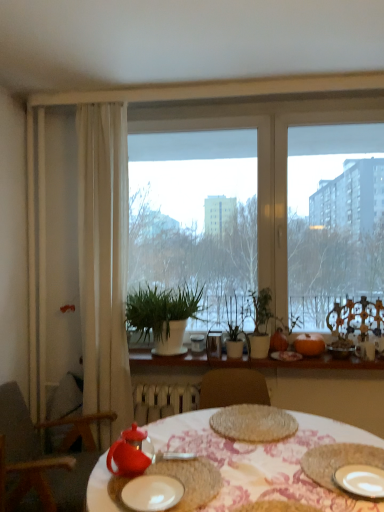
This screenshot has height=512, width=384. Find the location of `free space between white ceramic plate at lower right, placed as the first plate when sorted from right to left, and matte red teapot at lower left`. free space between white ceramic plate at lower right, placed as the first plate when sorted from right to left, and matte red teapot at lower left is located at coordinates (269, 483).